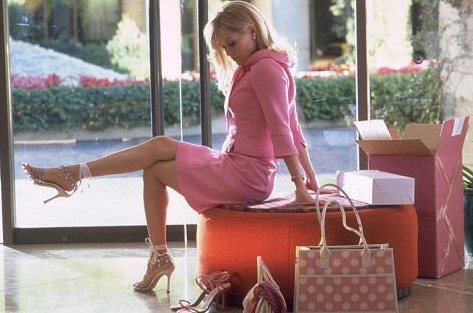
The width and height of the screenshot is (473, 313). What are the coordinates of `area to sit` in the screenshot? It's located at (267, 203), (344, 202).